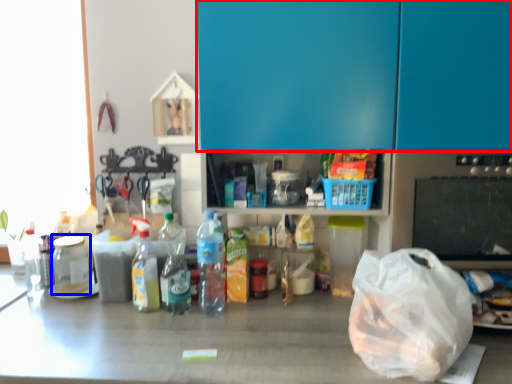
Question: Which object is closer to the camera taking this photo, leftover (highlighted by a red box) or bottle (highlighted by a blue box)?

Choices:
 (A) leftover
 (B) bottle

Answer: (A)